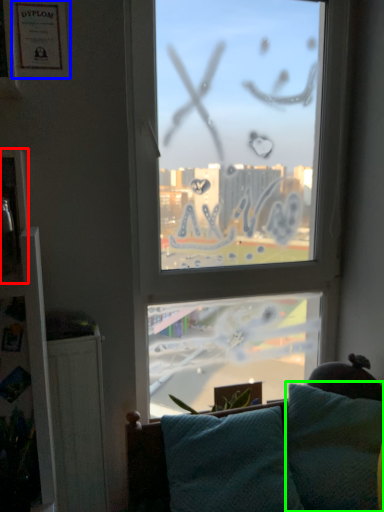
Question: Which object is positioned farthest from picture frame (highlighted by a red box)? Select from picture frame (highlighted by a blue box) and pillow (highlighted by a green box).

Choices:
 (A) picture frame
 (B) pillow

Answer: (B)